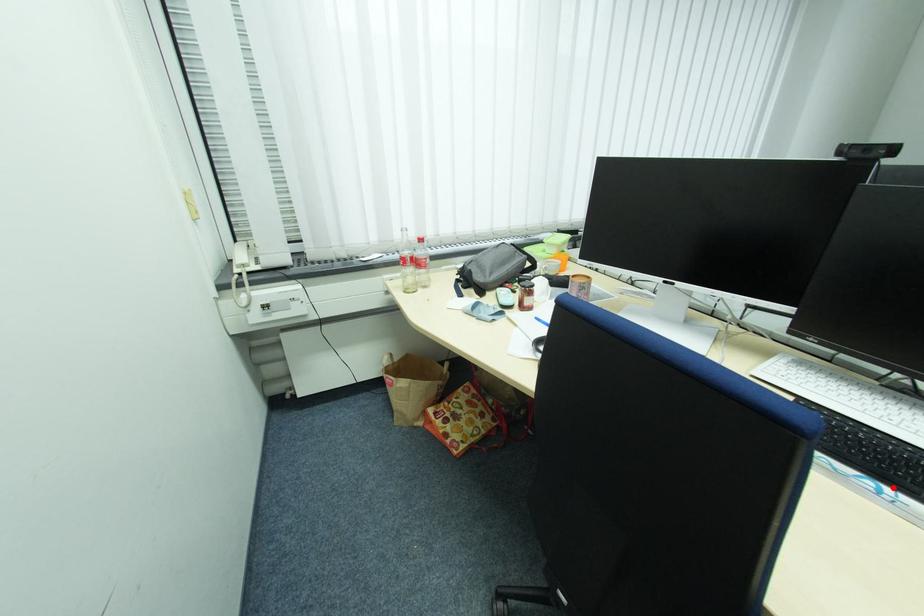
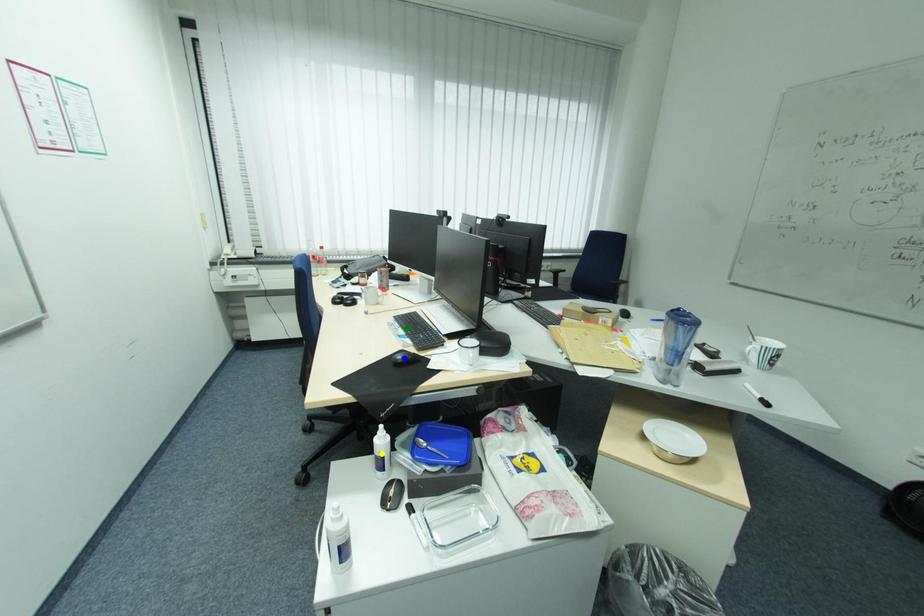
Question: I am providing you with two images of the same scene from different viewpoints. A red point is marked on the first image. You are given multiple points on the second image. Which mark in image 2 goes with the point in image 1?

Choices:
 (A) green point
 (B) yellow point
 (C) blue point

Answer: (A)